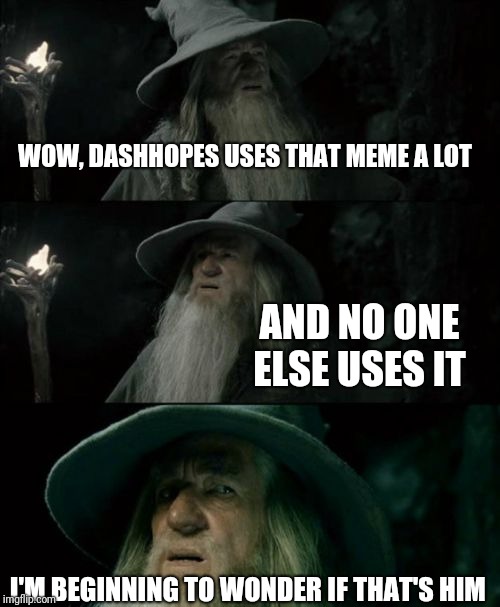
This screenshot has width=500, height=607. What are the coordinates of `clock` in the screenshot? It's located at (134, 181), (135, 392).